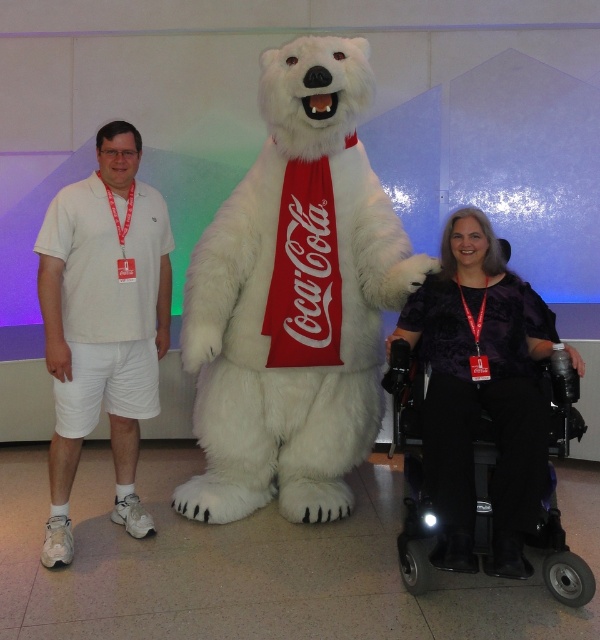
You are standing at the point marked as point (295, 300). What object is located exactly at this point?

The white plush bear at center is located exactly at point (295, 300).

You are a photographer setting up for a group photo. You need to position a white cotton shorts at left and a white plush bear at center such that there is at least 20 inches between them. Based on the current setup, is the distance sufficient?

The distance between the white plush bear at center and the white cotton shorts at left is currently 19.88 inches, which is less than the required 20 inches. Therefore, the current setup does not meet the distance requirement.

You are a photographer adjusting your camera settings to focus on the white cotton shorts at left and the purple satin dress at lower right. Which of these two items is closer to you?

The white cotton shorts at left is closer to you because it is further to the viewer than the purple satin dress at lower right.